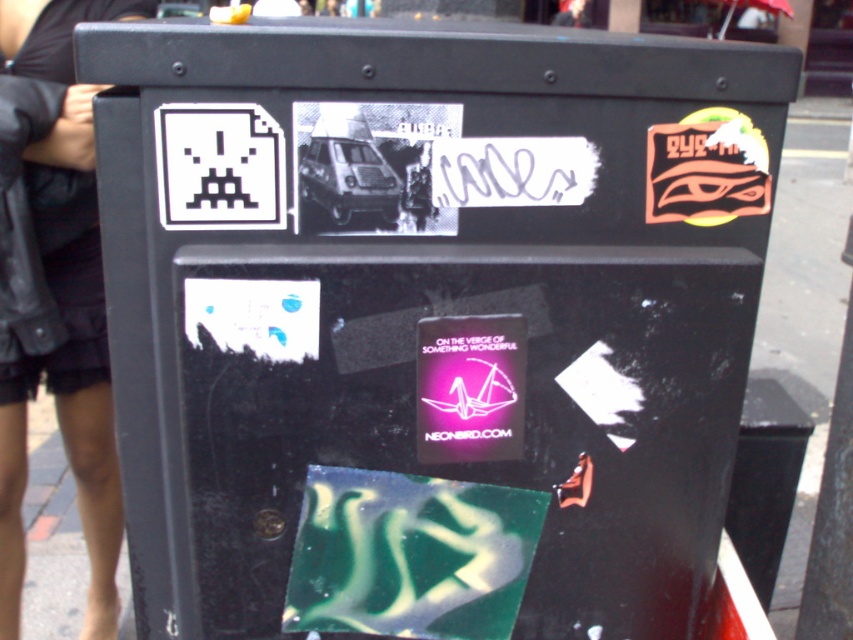
Is black leather jacket at upper left wider than white pixelated alien at upper left?

Correct, the width of black leather jacket at upper left exceeds that of white pixelated alien at upper left.

From the picture: Which is more to the right, black leather jacket at upper left or white pixelated alien at upper left?

white pixelated alien at upper left

This screenshot has height=640, width=853. I want to click on black leather jacket at upper left, so click(67, 438).